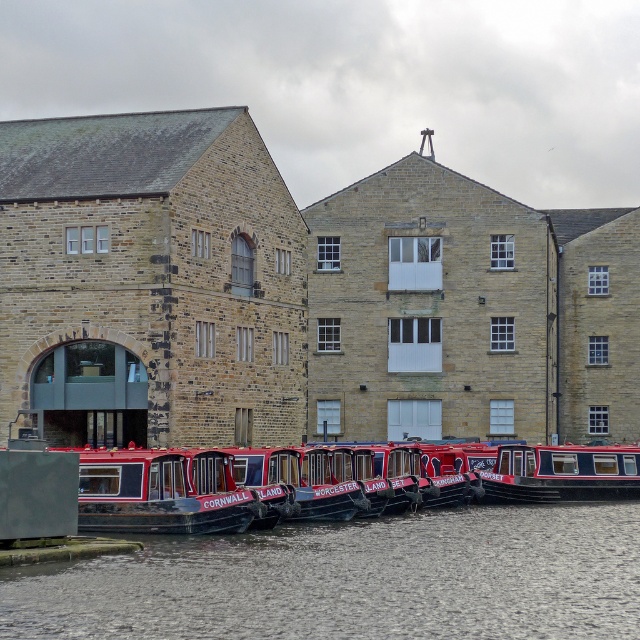
Question: Does smooth gray water at lower center appear over red polished wood boat at center?

Choices:
 (A) yes
 (B) no

Answer: (B)

Question: Which of the following is the closest to the observer?

Choices:
 (A) (300, 518)
 (B) (276, 531)
 (C) (148, 518)

Answer: (C)

Question: Which of the following is the closest to the observer?

Choices:
 (A) (129, 576)
 (B) (145, 509)

Answer: (A)

Question: Is smooth gray water at lower center bigger than metallic red canal boat at center?

Choices:
 (A) yes
 (B) no

Answer: (A)

Question: Which object appears closest to the camera in this image?

Choices:
 (A) red polished wood boat at center
 (B) smooth gray water at lower center

Answer: (B)

Question: Observing the image, what is the correct spatial positioning of smooth gray water at lower center in reference to metallic red canal boat at center?

Choices:
 (A) left
 (B) right

Answer: (B)